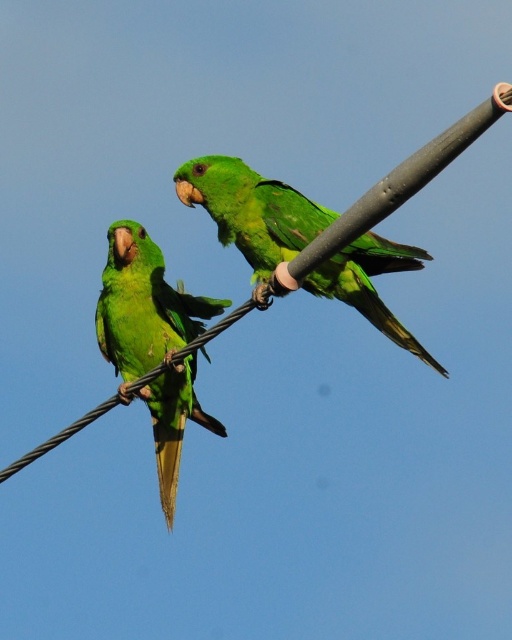
Question: Is green matte parrot at center below green matte parrot at left?

Choices:
 (A) no
 (B) yes

Answer: (A)

Question: Which point appears farthest from the camera in this image?

Choices:
 (A) (202, 419)
 (B) (347, 282)

Answer: (A)

Question: Is the position of green matte parrot at center less distant than that of green matte parrot at left?

Choices:
 (A) yes
 (B) no

Answer: (A)

Question: Is green matte parrot at center thinner than green matte parrot at left?

Choices:
 (A) yes
 (B) no

Answer: (B)